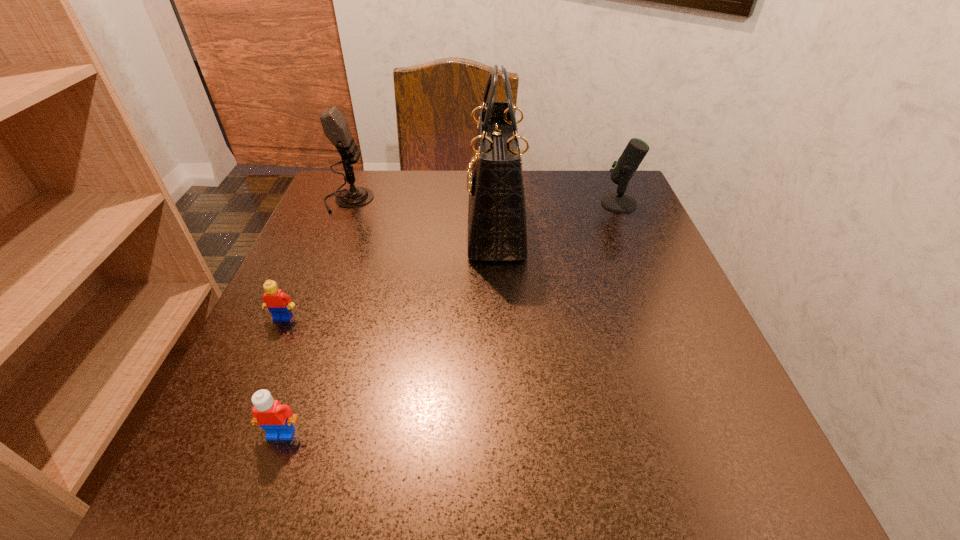
This screenshot has width=960, height=540. Identify the location of vacant area that lies between the handbag and the fourth farthest object. (390, 272).

Locate an element on the screen. free space between the left Lego and the rightmost object is located at coordinates (451, 260).

Find the location of a particular element. empty location between the farther Lego and the handbag is located at coordinates (390, 272).

This screenshot has height=540, width=960. Identify the location of unoccupied position between the fourth object from left to right and the left microphone. (422, 213).

Where is `free area in between the right Lego and the taller microphone`? The width and height of the screenshot is (960, 540). free area in between the right Lego and the taller microphone is located at coordinates (315, 317).

Find the location of a particular element. unoccupied position between the shorter microphone and the fourth object from left to right is located at coordinates (558, 215).

What are the coordinates of `vacant area that lies between the left Lego and the nearer Lego` in the screenshot? It's located at (282, 375).

Where is `free space between the farther Lego and the nearer Lego`? free space between the farther Lego and the nearer Lego is located at coordinates (282, 375).

Locate an element on the screen. This screenshot has height=540, width=960. blank region between the handbag and the left microphone is located at coordinates (422, 213).

Identify which object is the third nearest to the fourth farthest object. Please provide its 2D coordinates. Your answer should be formatted as a tuple, i.e. [(x, y)], where the tuple contains the x and y coordinates of a point satisfying the conditions above.

[(497, 229)]